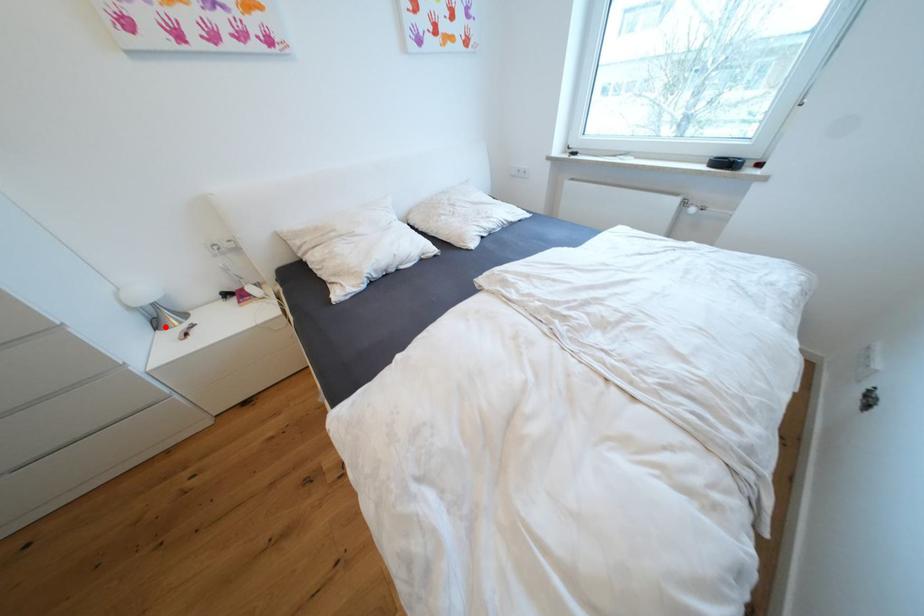
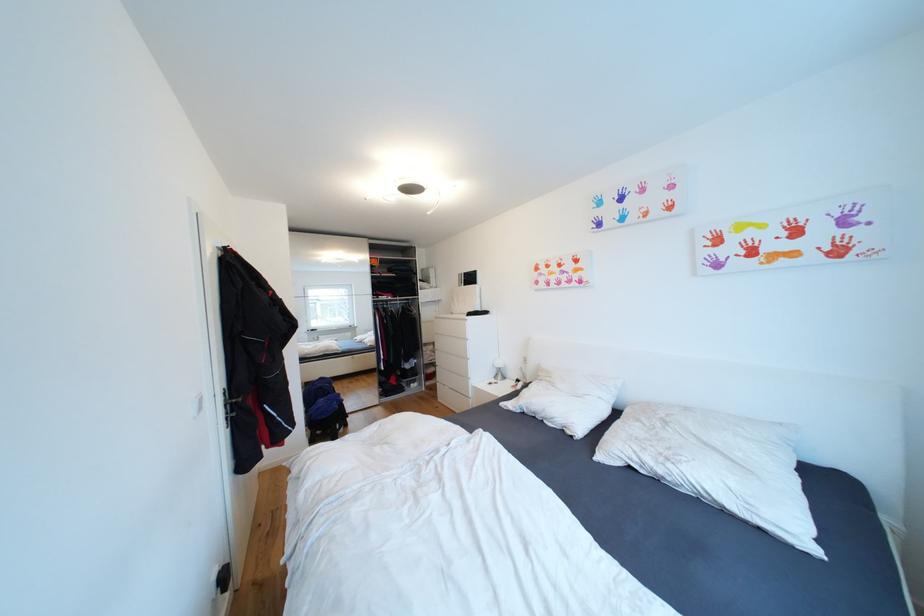
Find the pixel in the second image that matches the highlighted location in the first image.

(503, 378)